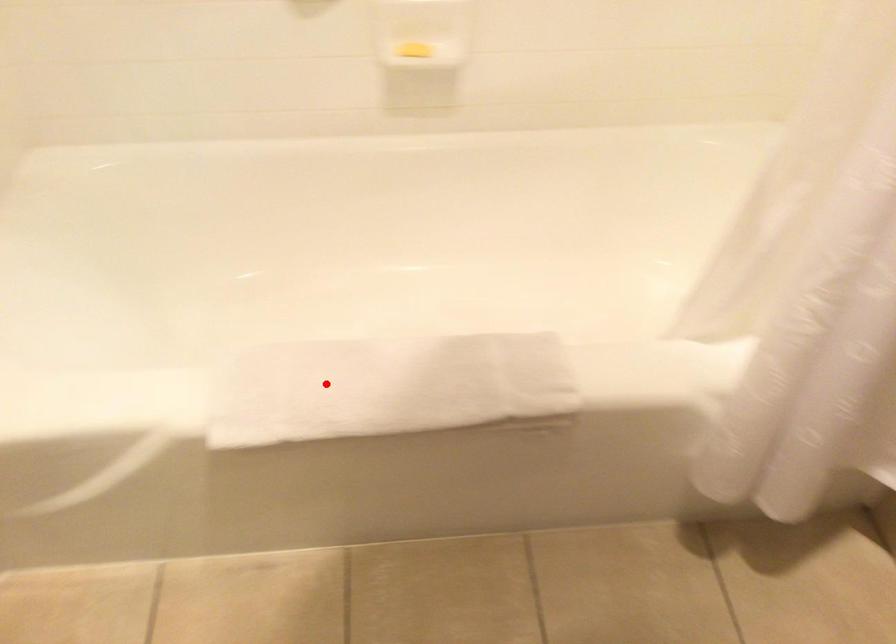
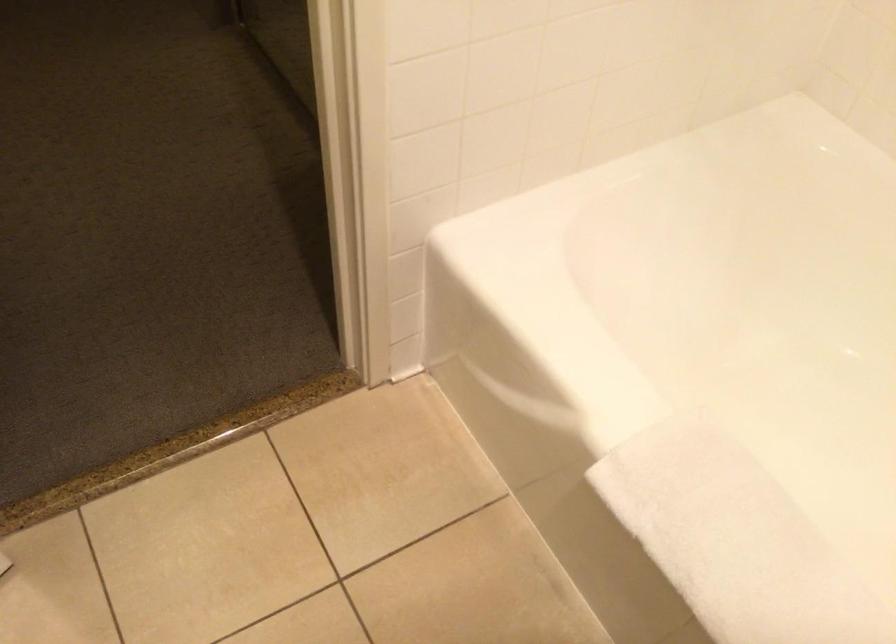
In the second image, find the point that corresponds to the highlighted location in the first image.

(736, 541)